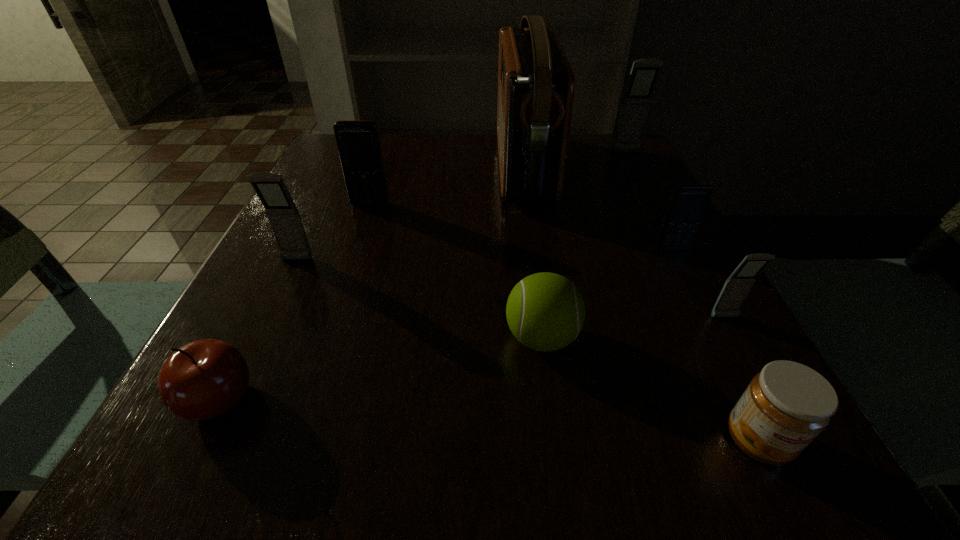
At what (x,y) coordinates should I click in order to perform the action: click on the smallest gray cellular telephone. Please return your answer as a coordinate pair (x, y). Image resolution: width=960 pixels, height=540 pixels. Looking at the image, I should click on (736, 288).

Identify the location of green tennis ball. (545, 311).

Image resolution: width=960 pixels, height=540 pixels. Identify the location of apple. (204, 379).

Image resolution: width=960 pixels, height=540 pixels. What are the coordinates of `jam` in the screenshot? It's located at (787, 405).

Find the location of a particular element. This screenshot has height=540, width=960. free location located 0.180m on the front-facing side of the tallest object is located at coordinates (422, 168).

At what (x,y) coordinates should I click in order to perform the action: click on vacant space located on the front-facing side of the tallest object. Please return your answer as a coordinate pair (x, y). The height and width of the screenshot is (540, 960). Looking at the image, I should click on (367, 168).

Find the location of a particular element. The width and height of the screenshot is (960, 540). free space located on the front-facing side of the tallest object is located at coordinates (328, 168).

Locate an element on the screen. Image resolution: width=960 pixels, height=540 pixels. vacant region located on the front-facing side of the biggest gray cellular telephone is located at coordinates (660, 215).

The height and width of the screenshot is (540, 960). I want to click on vacant space located 0.180m on the front-facing side of the second farthest gray cellular telephone, so 256,344.

Identify the location of vacant space located 0.270m on the screen of the fourth cellular telephone from right to left. Image resolution: width=960 pixels, height=540 pixels. (339, 298).